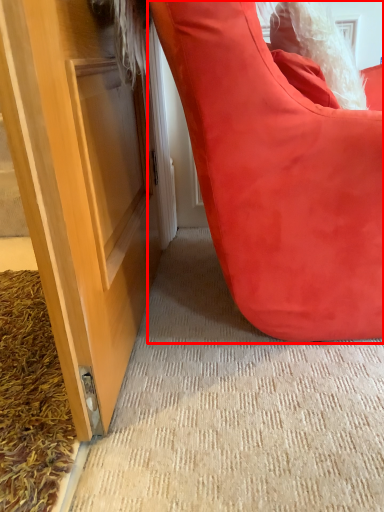
Question: From the image, what is the correct spatial relationship of furniture (annotated by the red box) in relation to doormat?

Choices:
 (A) left
 (B) right

Answer: (B)